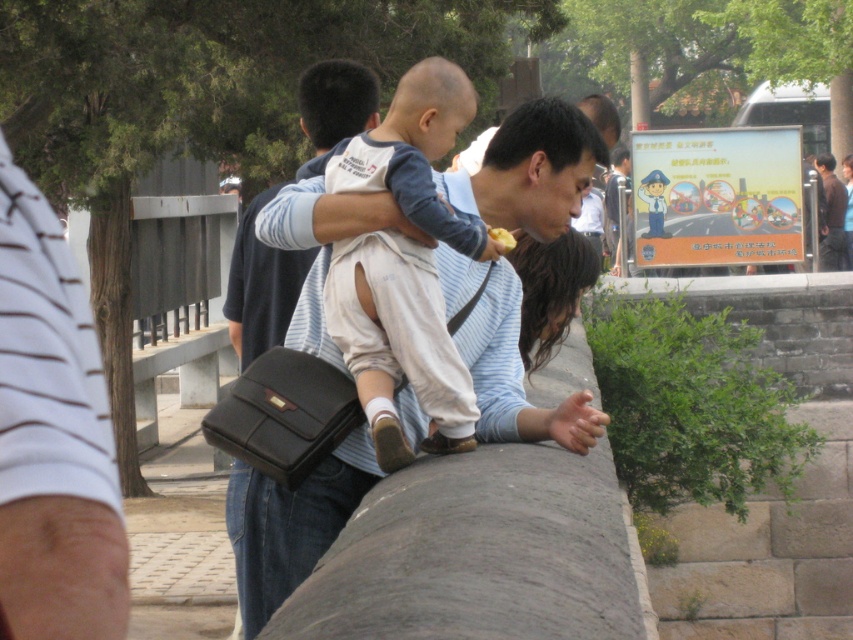
Question: Which of the following is the farthest from the observer?

Choices:
 (A) light blue striped shirt at center
 (B) brown leather jacket at upper right

Answer: (B)

Question: Is light blue striped shirt at center wider than light beige cotton pants at center?

Choices:
 (A) yes
 (B) no

Answer: (A)

Question: Can you confirm if dark brown hair at center is wider than brown leather jacket at upper right?

Choices:
 (A) no
 (B) yes

Answer: (A)

Question: Can you confirm if light blue striped shirt at center is positioned above white striped shirt at left?

Choices:
 (A) yes
 (B) no

Answer: (B)

Question: Among these objects, which one is nearest to the camera?

Choices:
 (A) brown leather jacket at upper right
 (B) light blue striped shirt at center
 (C) light beige cotton pants at center
 (D) white striped shirt at left

Answer: (D)

Question: Among these objects, which one is nearest to the camera?

Choices:
 (A) light blue striped shirt at center
 (B) light beige cotton pants at center
 (C) white striped shirt at left
 (D) dark brown hair at center

Answer: (C)